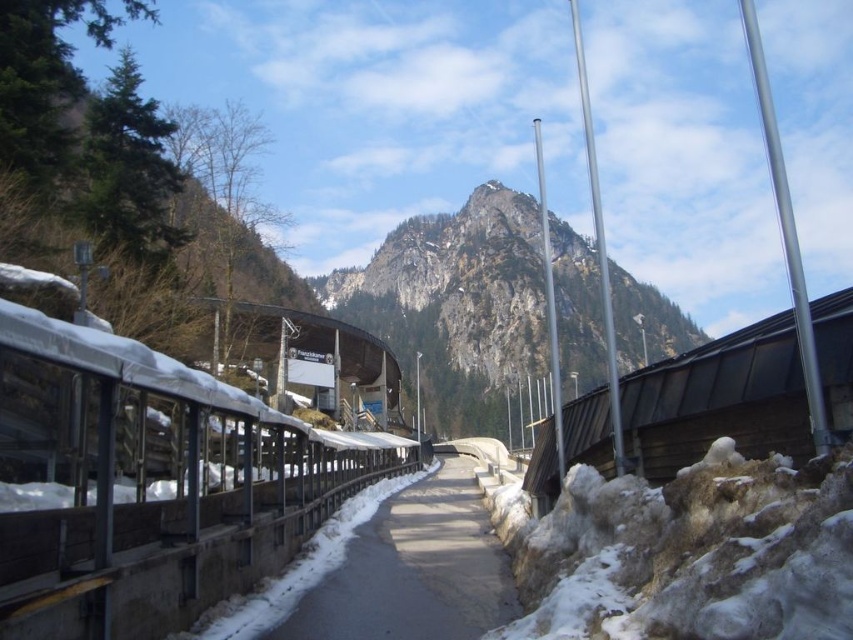
Which is in front, point (448, 486) or point (276, 360)?

Point (448, 486)

Which is in front, point (412, 509) or point (311, 321)?

Positioned in front is point (412, 509).

What are the coordinates of `smooth asphalt path at center` in the screenshot? It's located at (413, 570).

Is rugged stone mountain at center in front of wooden signboard at center?

No, rugged stone mountain at center is further to the viewer.

Is rugged stone mountain at center shorter than wooden signboard at center?

No.

Image resolution: width=853 pixels, height=640 pixels. In order to click on rugged stone mountain at center in this screenshot , I will do `click(456, 301)`.

I want to click on rugged stone mountain at center, so click(456, 301).